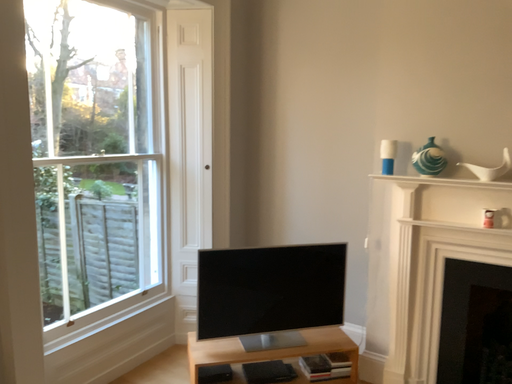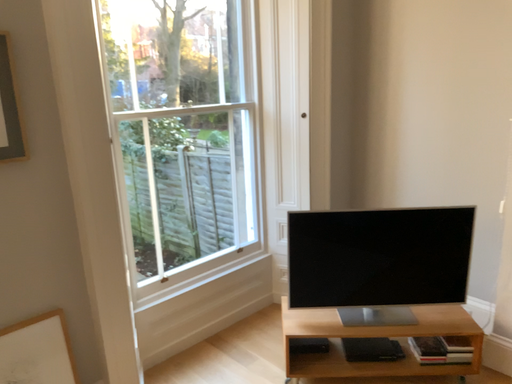
Question: Which way did the camera rotate in the video?

Choices:
 (A) rotated left
 (B) rotated right

Answer: (A)